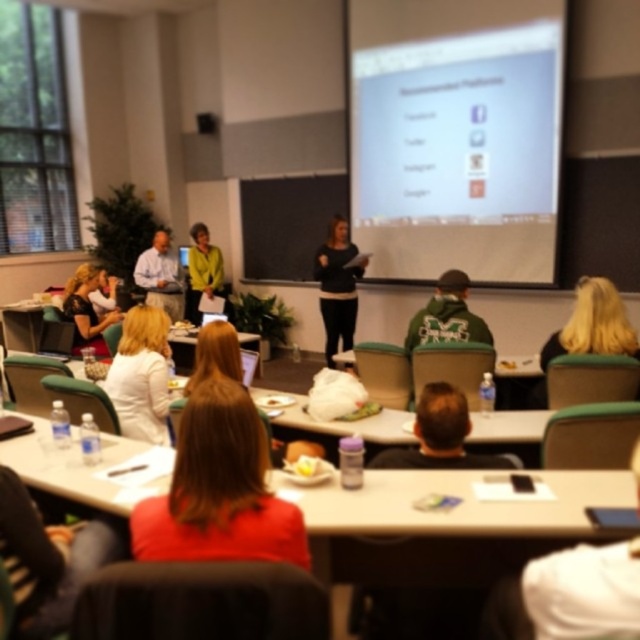
Question: Can you confirm if green fuzzy hoodie at center is positioned to the left of light blue shirt at center?

Choices:
 (A) no
 (B) yes

Answer: (A)

Question: Estimate the real-world distances between objects in this image. Which object is closer to the white glossy projector screen at upper center?

Choices:
 (A) white fabric shirt at lower right
 (B) brown hair at center

Answer: (B)

Question: Which of the following is the farthest from the observer?

Choices:
 (A) light blue shirt at center
 (B) blonde hair at center

Answer: (A)

Question: Where is white plastic table at center located in relation to blonde hair at center in the image?

Choices:
 (A) below
 (B) above

Answer: (A)

Question: Is matte black sweater at center positioned in front of light blue shirt at center?

Choices:
 (A) yes
 (B) no

Answer: (A)

Question: Among these points, which one is farthest from the camera?

Choices:
 (A) 380,157
 (B) 19,412
 (C) 168,262

Answer: (C)